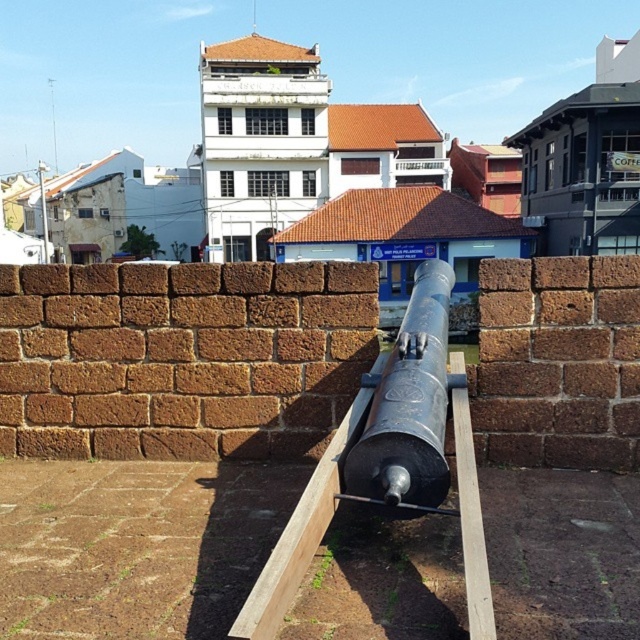
Question: Is black metal cannon at center bigger than matte black cannon at center?

Choices:
 (A) no
 (B) yes

Answer: (B)

Question: Which of the following is the farthest from the observer?

Choices:
 (A) black metal cannon at center
 (B) matte black cannon at center

Answer: (B)

Question: Can you confirm if black metal cannon at center is wider than matte black cannon at center?

Choices:
 (A) no
 (B) yes

Answer: (B)

Question: Which point is farther from the camera taking this photo?

Choices:
 (A) (284, 609)
 (B) (396, 397)

Answer: (B)

Question: Can you confirm if black metal cannon at center is positioned to the left of matte black cannon at center?

Choices:
 (A) yes
 (B) no

Answer: (A)